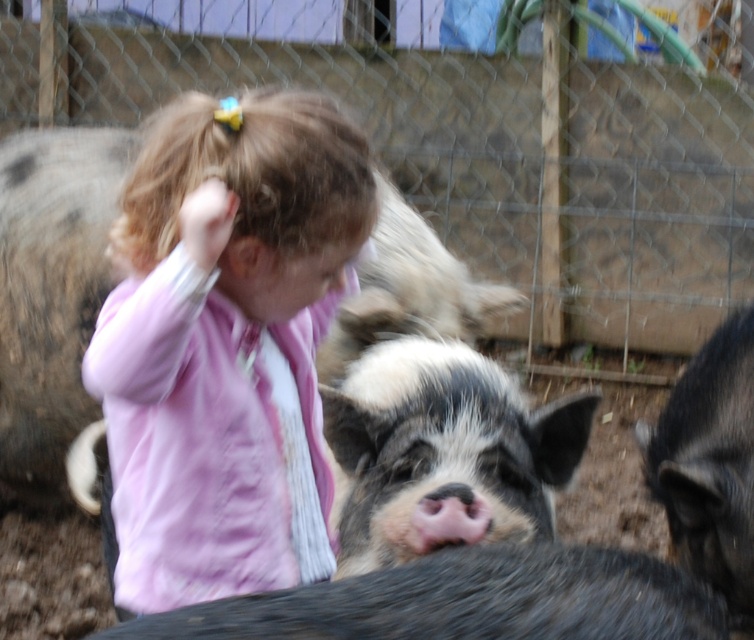
You are standing at the point with coordinates point [164,186] and want to walk to the point with coordinates point [394,621]. Which direction should you move in?

You should move forward because point [164,186] is behind point [394,621], so moving forward from point [164,186] will lead you toward point [394,621].

You are a farmer who wants to separate the speckled fur pig at center and the black fuzzy pig at center into two different pens. Based on their positions in the image, which pig should you move to the left pen?

The speckled fur pig at center is to the right of the black fuzzy pig at center, so you should move the black fuzzy pig at center to the left pen to keep it closer to its original position.